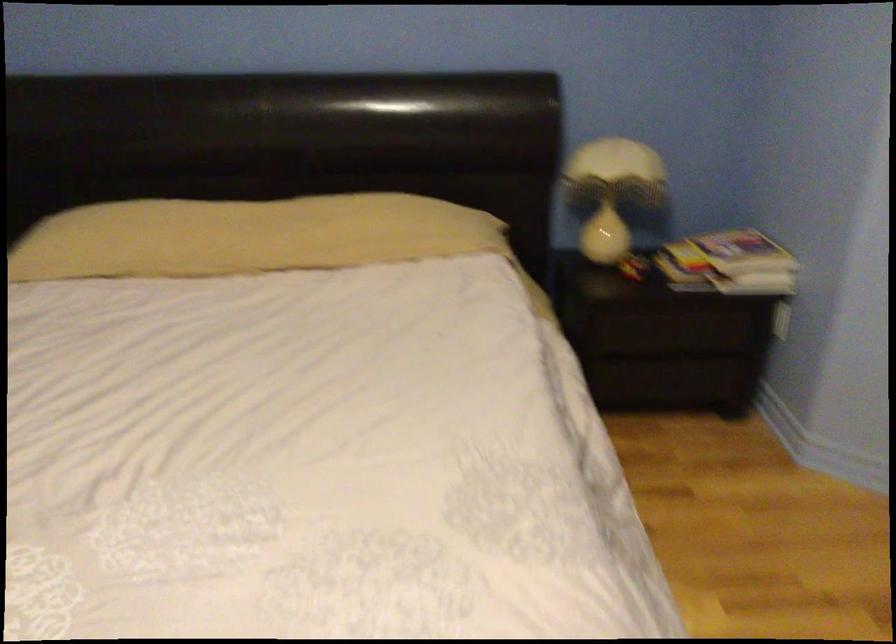
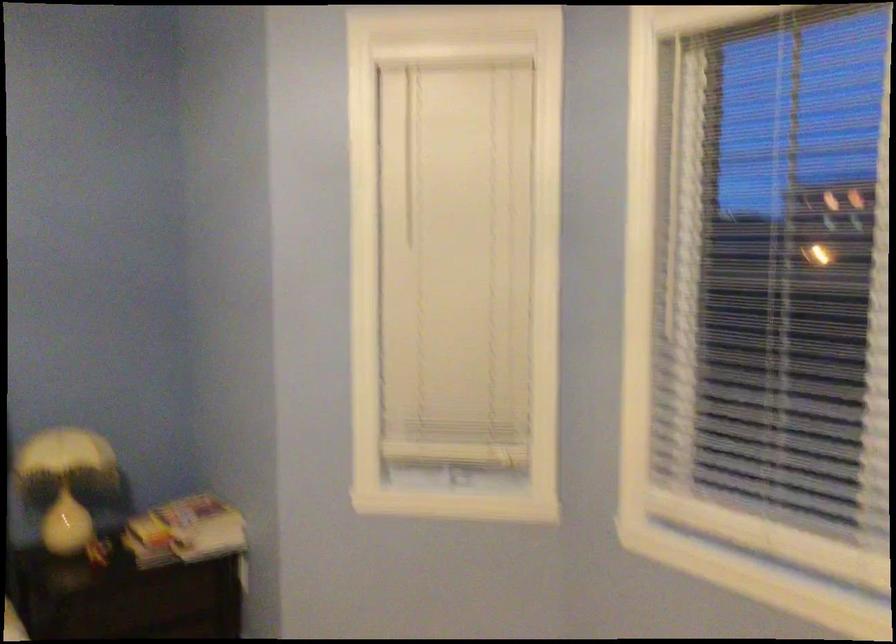
Find the pixel in the second image that matches pixel 725 259 in the first image.

(185, 532)